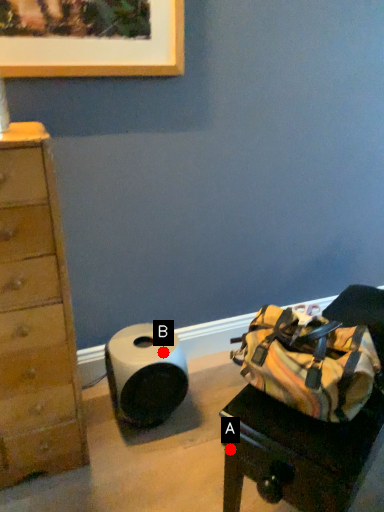
Question: Two points are circled on the image, labeled by A and B beside each circle. Which of the following is the closest to the observer?

Choices:
 (A) A is closer
 (B) B is closer

Answer: (A)